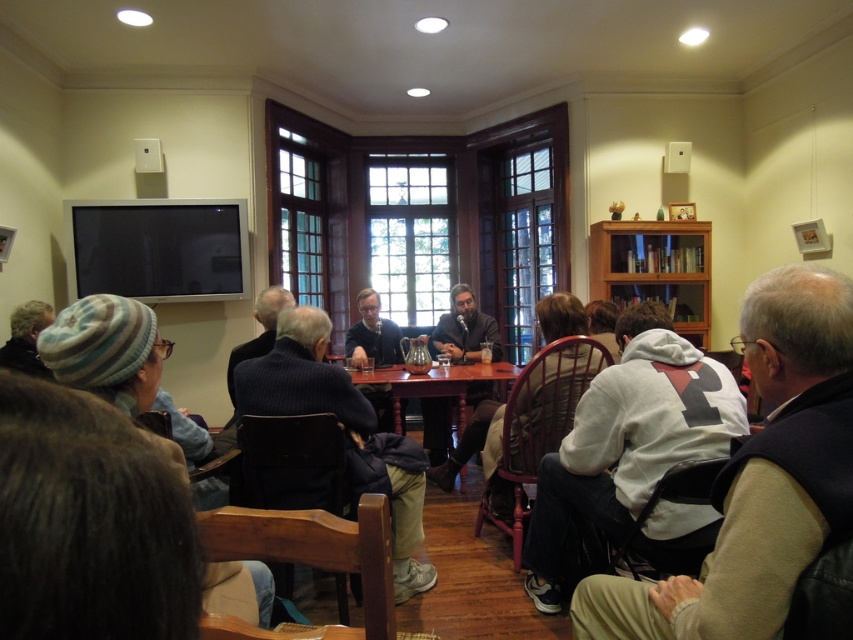
Is point (456, 380) less distant than point (21, 344)?

No, it is not.

Locate an element on the screen. wooden table at center is located at coordinates (439, 385).

Is the position of striped wool hat at lower left more distant than that of wooden table at center?

That is False.

Does point (109, 328) come farther from viewer compared to point (399, 429)?

No, it is not.

Which is behind, point (262, 602) or point (409, 378)?

The point (409, 378) is behind.

Image resolution: width=853 pixels, height=640 pixels. I want to click on striped wool hat at lower left, so click(107, 349).

Is point (267, 413) more distant than point (393, 371)?

No, (267, 413) is in front of (393, 371).

Does dark blue sweater at center appear on the right side of wooden table at center?

In fact, dark blue sweater at center is to the left of wooden table at center.

Find the location of `dark blue sweater at center`. dark blue sweater at center is located at coordinates (345, 429).

Find the location of a particular element. Image resolution: width=853 pixels, height=640 pixels. dark blue sweater at center is located at coordinates (345, 429).